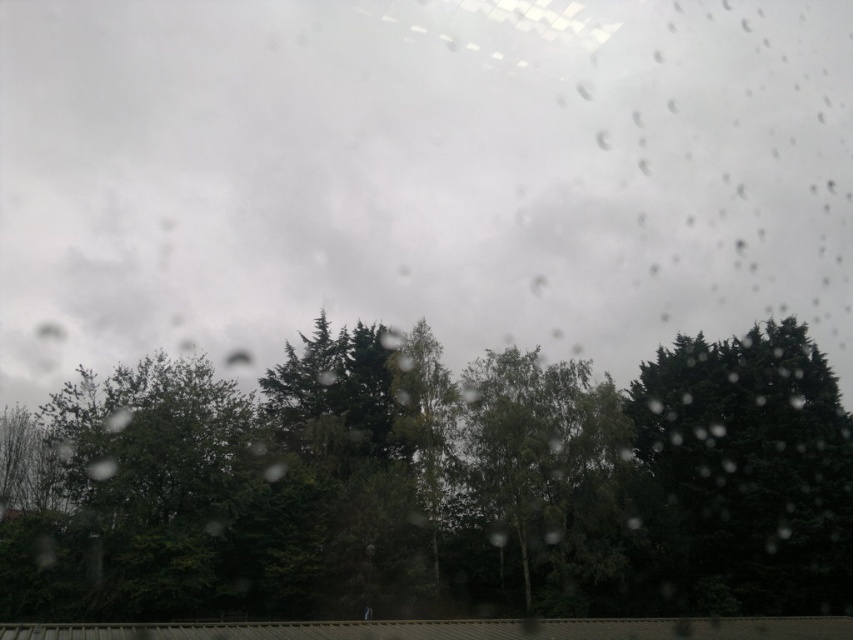
You are a passenger in the car and notice two trees through the rain streaked window. Which of the two, the green matte tree at center or the green leafy tree at center, is positioned higher up in the view?

The green matte tree at center is positioned higher up in the view than the green leafy tree at center.

You are a driver trying to navigate through a narrow path between two trees. You see the green matte tree at center and the dark green leafy tree at right. Which tree has a wider trunk to consider for avoiding collision?

The green matte tree at center has a wider trunk than the dark green leafy tree at right, so you should avoid the green matte tree at center to prevent collision.